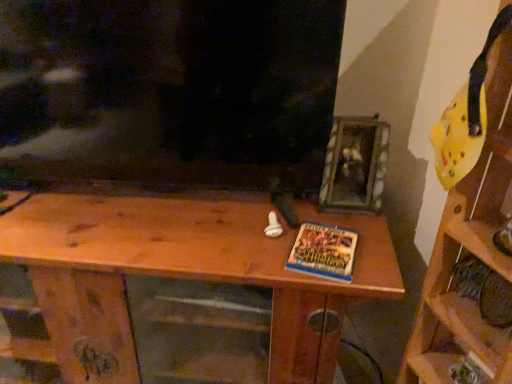
This screenshot has width=512, height=384. I want to click on vacant space behind blue glossy book at center, so click(323, 216).